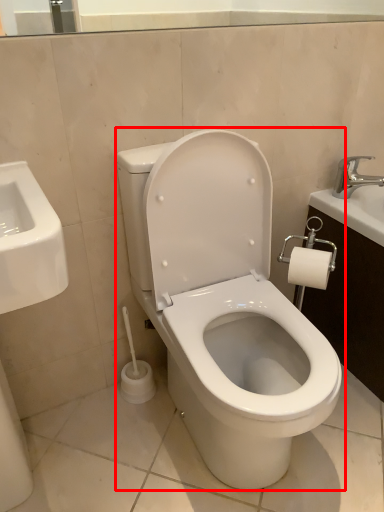
Question: From the image's perspective, considering the relative positions of toilet (annotated by the red box) and tap in the image provided, where is toilet (annotated by the red box) located with respect to the staircase?

Choices:
 (A) above
 (B) below

Answer: (B)